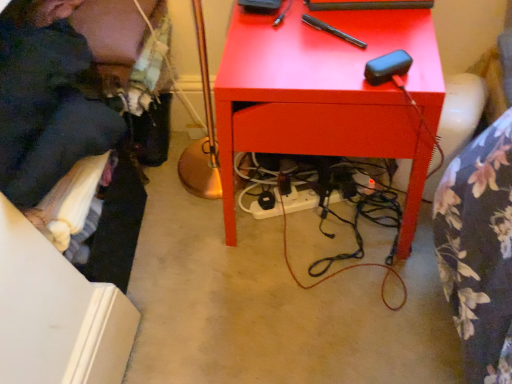
Where is `free space in front of matte red desk at center`? free space in front of matte red desk at center is located at coordinates (323, 315).